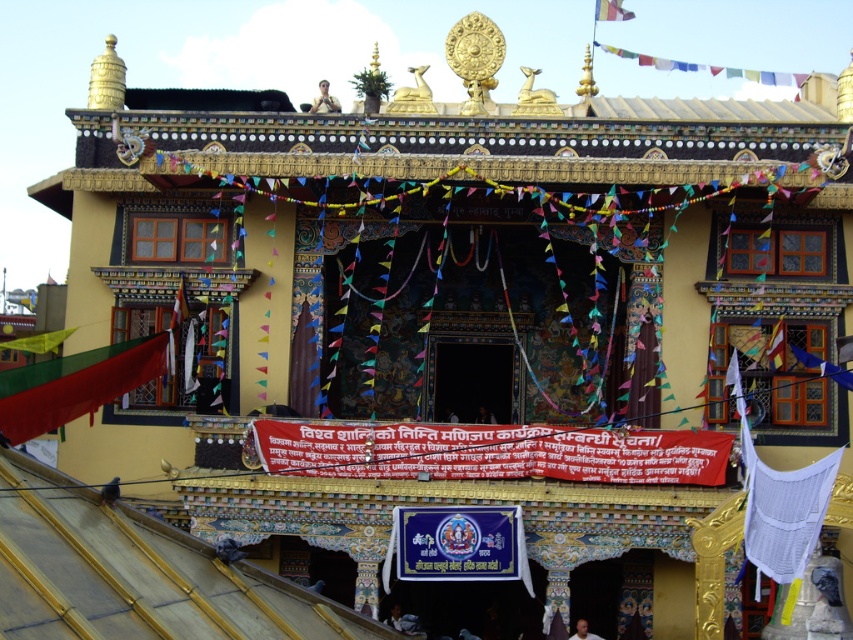
Is matte gold statue at upper center to the left of smooth skin face at center from the viewer's perspective?

Indeed, matte gold statue at upper center is positioned on the left side of smooth skin face at center.

What do you see at coordinates (323, 100) in the screenshot?
I see `matte gold statue at upper center` at bounding box center [323, 100].

Is point (326, 93) positioned behind point (579, 627)?

That is True.

The image size is (853, 640). Find the location of `matte gold statue at upper center`. matte gold statue at upper center is located at coordinates (323, 100).